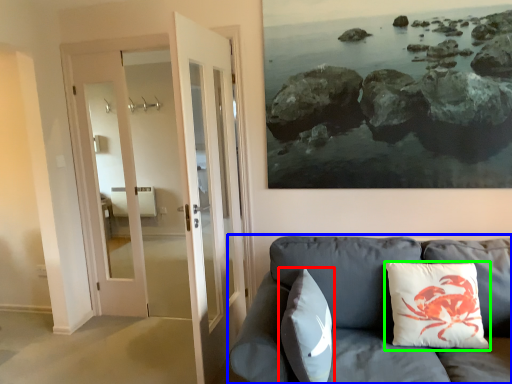
Question: Considering the real-world distances, which object is farthest from pillow (highlighted by a red box)? studio couch (highlighted by a blue box) or pillow (highlighted by a green box)?

Choices:
 (A) studio couch
 (B) pillow

Answer: (B)